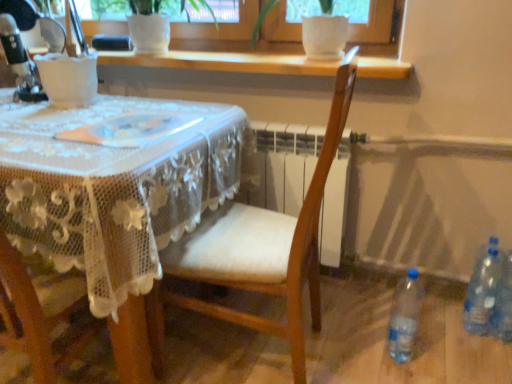
The height and width of the screenshot is (384, 512). Identify the location of vacant space in between wooden chair at center and transparent plastic bottle at lower right, the 1th bottle in the left-to-right sequence. pyautogui.click(x=356, y=357).